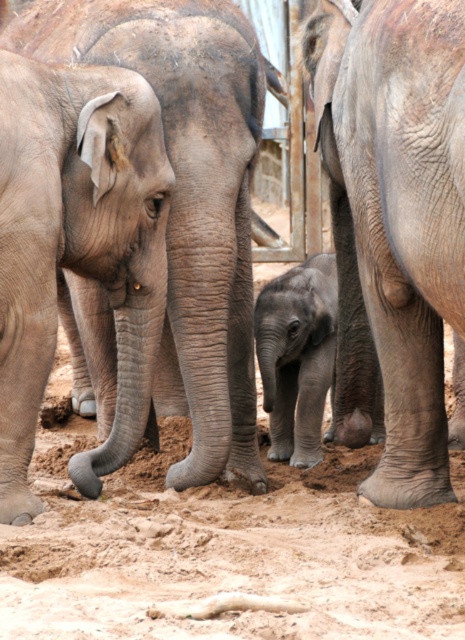
Is gray wrinkled elephant at center to the left of gray matte elephant at left from the viewer's perspective?

In fact, gray wrinkled elephant at center is to the right of gray matte elephant at left.

In the scene shown: Does gray wrinkled elephant at center appear under gray matte elephant at left?

No.

What do you see at coordinates (394, 220) in the screenshot?
I see `gray wrinkled elephant at center` at bounding box center [394, 220].

Locate an element on the screen. This screenshot has width=465, height=640. gray wrinkled elephant at center is located at coordinates (394, 220).

Is gray wrinkled elephant at center thinner than gray matte elephant at center?

No, gray wrinkled elephant at center is not thinner than gray matte elephant at center.

Does gray wrinkled elephant at center lie in front of gray matte elephant at center?

That is True.

Who is more forward, (x=356, y=442) or (x=312, y=385)?

Point (x=356, y=442) is in front.

Identify the location of gray wrinkled elephant at center. (394, 220).

Can you confirm if gray matte elephant at left is thinner than gray matte elephant at center?

No, gray matte elephant at left is not thinner than gray matte elephant at center.

Is point (20, 368) more distant than point (299, 369)?

No, it is in front of (299, 369).

Locate an element on the screen. gray matte elephant at left is located at coordinates (77, 248).